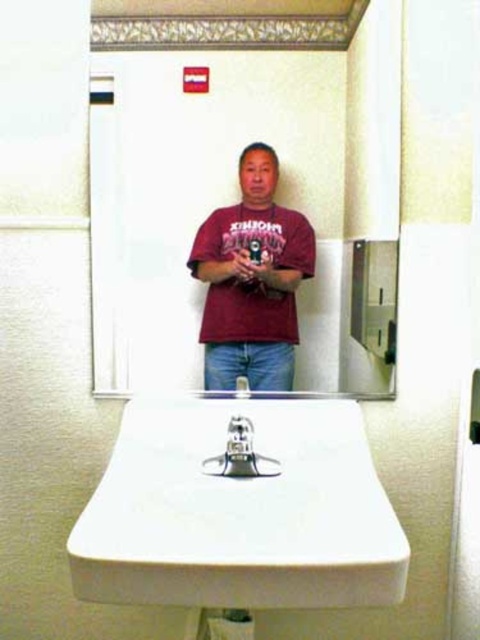
Is matte maroon shirt at center further to camera compared to satin nickel faucet at center?

Yes, matte maroon shirt at center is further from the viewer.

Is matte maroon shirt at center bigger than satin nickel faucet at center?

Yes, matte maroon shirt at center is bigger than satin nickel faucet at center.

The image size is (480, 640). Find the location of `matte maroon shirt at center`. matte maroon shirt at center is located at coordinates tap(237, 193).

What are the coordinates of `matte maroon shirt at center` in the screenshot? It's located at (237, 193).

Describe the element at coordinates (237, 193) in the screenshot. I see `matte maroon shirt at center` at that location.

Between point (142, 138) and point (204, 268), which one is positioned behind?

Positioned behind is point (204, 268).

Is point (317, 337) less distant than point (237, 317)?

No, (317, 337) is behind (237, 317).

This screenshot has height=640, width=480. In order to click on matte maroon shirt at center in this screenshot , I will do `click(237, 193)`.

Is maroon cotton t-shirt at center closer to the viewer compared to satin nickel faucet at center?

No, maroon cotton t-shirt at center is behind satin nickel faucet at center.

Does point (269, 305) lie in front of point (244, 435)?

No, (269, 305) is behind (244, 435).

Locate an element on the screen. maroon cotton t-shirt at center is located at coordinates (252, 280).

Locate an element on the screen. The image size is (480, 640). maroon cotton t-shirt at center is located at coordinates (252, 280).